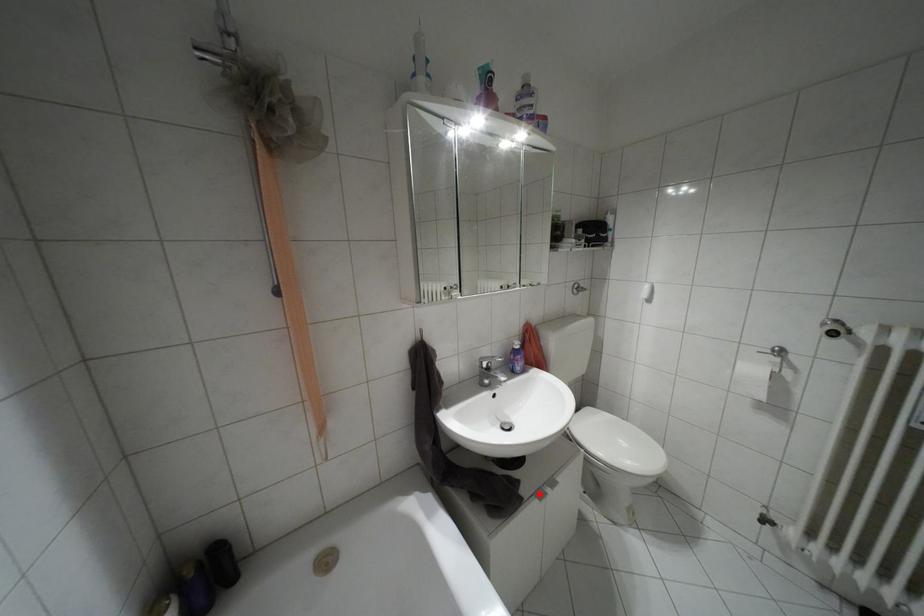
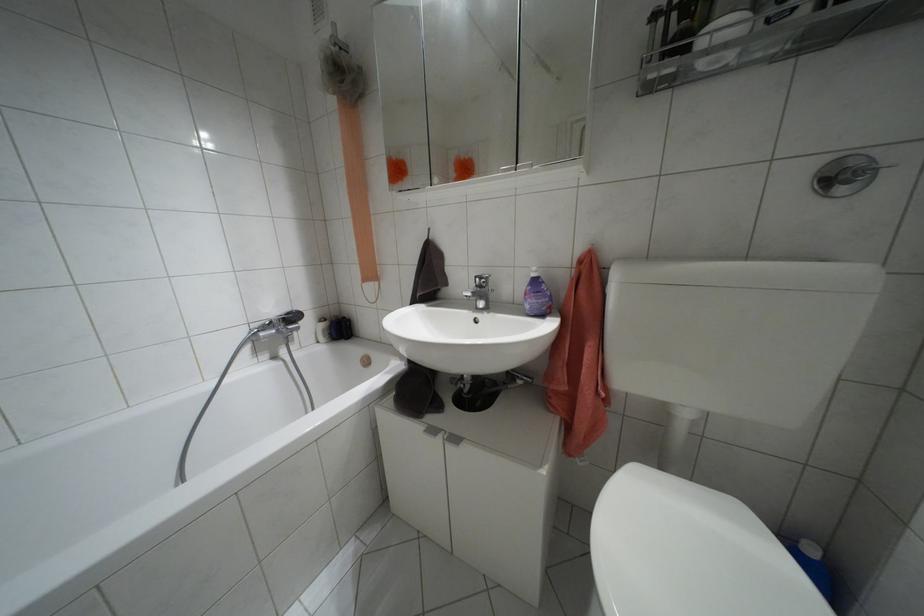
Where in the second image is the point corresponding to the highlighted location from the first image?

(432, 430)